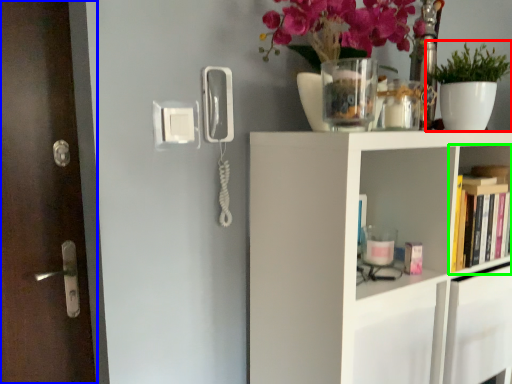
Question: Which is farther away from houseplant (highlighted by a red box)? door (highlighted by a blue box) or shelf (highlighted by a green box)?

Choices:
 (A) door
 (B) shelf

Answer: (A)